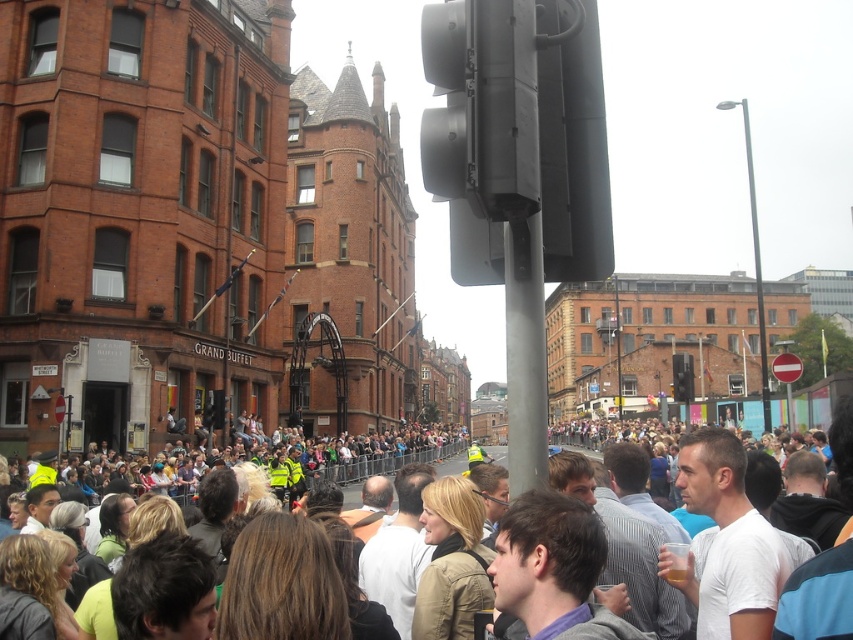
You are standing in the middle of the crowd at the urban event. You see two points marked in the scene. Which point is closer to you, point (508,115) or point (521,438)?

Point (508,115) is closer to the viewer than point (521,438).

You are a delivery person trying to navigate through the busy street. You see two traffic lights ahead. The first is the black matte traffic light at upper center and the second is the black plastic traffic light at center. Which traffic light is on the left side when looking towards them?

The black matte traffic light at upper center is positioned on the left side of the black plastic traffic light at center, so when looking towards them, the black matte traffic light at upper center is on the left.